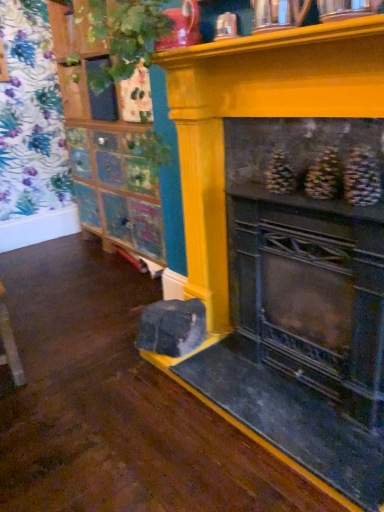
Question: Is yellow painted wood fireplace at center positioned with its back to green leafy plant at upper left?

Choices:
 (A) no
 (B) yes

Answer: (A)

Question: Does yellow painted wood fireplace at center lie in front of green leafy plant at upper left?

Choices:
 (A) no
 (B) yes

Answer: (B)

Question: Is yellow painted wood fireplace at center aimed at green leafy plant at upper left?

Choices:
 (A) yes
 (B) no

Answer: (B)

Question: Is the surface of yellow painted wood fireplace at center in direct contact with green leafy plant at upper left?

Choices:
 (A) no
 (B) yes

Answer: (A)

Question: Is yellow painted wood fireplace at center shorter than green leafy plant at upper left?

Choices:
 (A) yes
 (B) no

Answer: (B)

Question: From the image's perspective, would you say yellow painted wood fireplace at center is positioned over green leafy plant at upper left?

Choices:
 (A) yes
 (B) no

Answer: (B)

Question: Is wooden cabinet at upper left, the first shelf when ordered from front to back, smaller than yellow painted wood fireplace at center?

Choices:
 (A) no
 (B) yes

Answer: (B)

Question: Is wooden cabinet at upper left, the first shelf when ordered from front to back, far away from yellow painted wood fireplace at center?

Choices:
 (A) yes
 (B) no

Answer: (A)

Question: From the image's perspective, is wooden cabinet at upper left, the first shelf when ordered from front to back, below yellow painted wood fireplace at center?

Choices:
 (A) no
 (B) yes

Answer: (A)

Question: Is wooden cabinet at upper left, the second shelf when ordered from back to front, further to the viewer compared to yellow painted wood fireplace at center?

Choices:
 (A) no
 (B) yes

Answer: (B)

Question: Is wooden cabinet at upper left, the first shelf when ordered from front to back, wider than yellow painted wood fireplace at center?

Choices:
 (A) no
 (B) yes

Answer: (B)

Question: Is wooden cabinet at upper left, the 1th shelf from the right, in contact with yellow painted wood fireplace at center?

Choices:
 (A) yes
 (B) no

Answer: (B)

Question: Could you tell me if green leafy plant at upper left is turned towards multicolored painted cabinet at left, which is the 2th shelf from front to back?

Choices:
 (A) yes
 (B) no

Answer: (B)